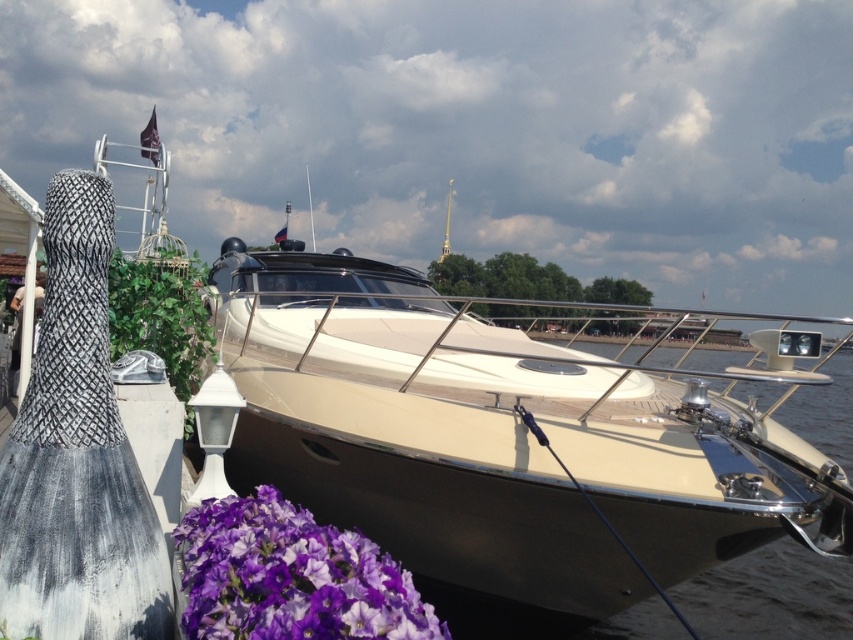
Question: Does purple matte flower at lower left lie in front of smooth beige water at center?

Choices:
 (A) no
 (B) yes

Answer: (B)

Question: Which is farther from the cream matte boat at center?

Choices:
 (A) purple matte flower at lower left
 (B) smooth beige water at center

Answer: (B)

Question: Which of these objects is positioned farthest from the cream matte boat at center?

Choices:
 (A) purple matte flower at lower left
 (B) smooth beige water at center

Answer: (B)

Question: Can you confirm if cream matte boat at center is positioned above purple matte flower at lower left?

Choices:
 (A) no
 (B) yes

Answer: (B)

Question: Which point is farther to the camera?

Choices:
 (A) cream matte boat at center
 (B) purple matte flower at lower left

Answer: (A)

Question: Does cream matte boat at center have a smaller size compared to smooth beige water at center?

Choices:
 (A) no
 (B) yes

Answer: (B)